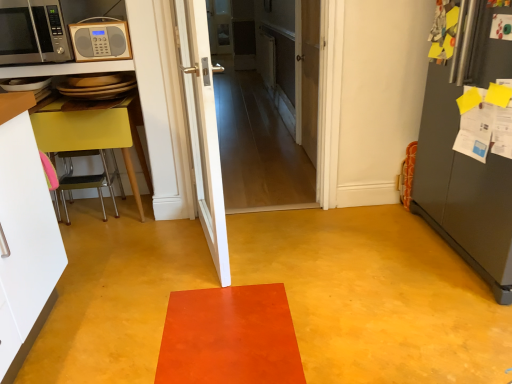
Question: Visually, is yellow matte table at left positioned to the left or to the right of white wooden door at center, which is counted as the 2th door, starting from the back?

Choices:
 (A) right
 (B) left

Answer: (B)

Question: Considering the positions of yellow matte table at left and white wooden door at center, the 2th door positioned from the front, in the image, is yellow matte table at left taller or shorter than white wooden door at center, the 2th door positioned from the front,?

Choices:
 (A) tall
 (B) short

Answer: (B)

Question: Estimate the real-world distances between objects in this image. Which object is farther from the matte silver microwave at upper left, marked as the 1th microwave oven in a right-to-left arrangement?

Choices:
 (A) white wooden door at center, which is counted as the 2th door, starting from the back
 (B) white glossy door at center, acting as the third door starting from the back
 (C) wooden door at center, marked as the third door in a front-to-back arrangement
 (D) silver metallic microwave at upper left, marked as the 2th microwave oven in a right-to-left arrangement
 (E) yellow matte table at left

Answer: (A)

Question: Based on their relative distances, which object is farther from the white wooden door at center, which is counted as the 2th door, starting from the back?

Choices:
 (A) silver metallic microwave at upper left, marked as the 2th microwave oven in a right-to-left arrangement
 (B) matte silver microwave at upper left, the 2th microwave oven positioned from the left
 (C) wooden door at center, which is the first door in back-to-front order
 (D) white glossy door at center, which appears as the first door when viewed from the front
 (E) yellow matte table at left

Answer: (A)